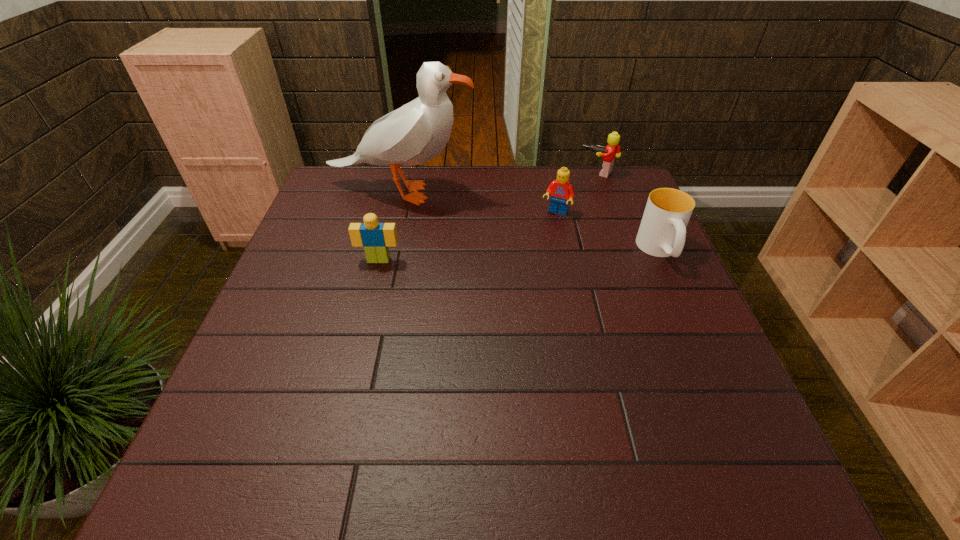
In order to click on vacant area between the farthest Lego and the gull in this screenshot , I will do `click(499, 183)`.

Locate an element on the screen. Image resolution: width=960 pixels, height=540 pixels. vacant space that's between the third object from right to left and the tallest object is located at coordinates (478, 203).

The width and height of the screenshot is (960, 540). What are the coordinates of `free point between the farthest Lego and the nearest Lego` in the screenshot? It's located at (489, 217).

You are a GUI agent. You are given a task and a screenshot of the screen. Output one action in this format:
    pyautogui.click(x=<x>, y=<y>)
    Task: Click on the free space between the second farthest Lego and the nearest Lego
    Image resolution: width=960 pixels, height=540 pixels.
    Given the screenshot: What is the action you would take?
    pyautogui.click(x=468, y=237)

Image resolution: width=960 pixels, height=540 pixels. What are the coordinates of `vacant area that lies between the rightmost Lego and the third object from left to right` in the screenshot? It's located at (577, 193).

Where is `unoccupied position between the tallest object and the rightmost Lego`? The width and height of the screenshot is (960, 540). unoccupied position between the tallest object and the rightmost Lego is located at coordinates pyautogui.click(x=499, y=183).

This screenshot has height=540, width=960. What are the coordinates of `free spot between the third object from right to left and the rightmost Lego` in the screenshot? It's located at (577, 193).

Where is `empty location between the rightmost Lego and the second farthest Lego`? The height and width of the screenshot is (540, 960). empty location between the rightmost Lego and the second farthest Lego is located at coordinates (577, 193).

In order to click on vacant space that's between the leftmost Lego and the farthest Lego in this screenshot , I will do `click(489, 217)`.

Identify the location of object that is the third closest to the second farthest Lego. The width and height of the screenshot is (960, 540). (415, 133).